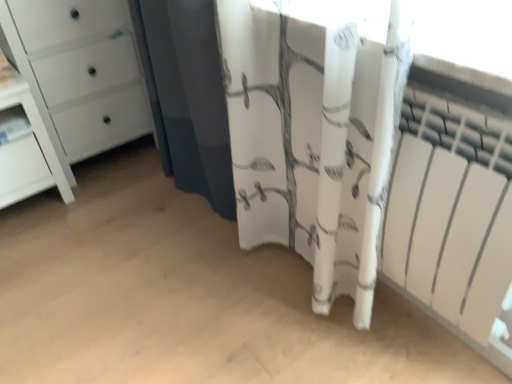
The image size is (512, 384). Find the location of `vacant space to the left of white fabric curtain at center`. vacant space to the left of white fabric curtain at center is located at coordinates (184, 291).